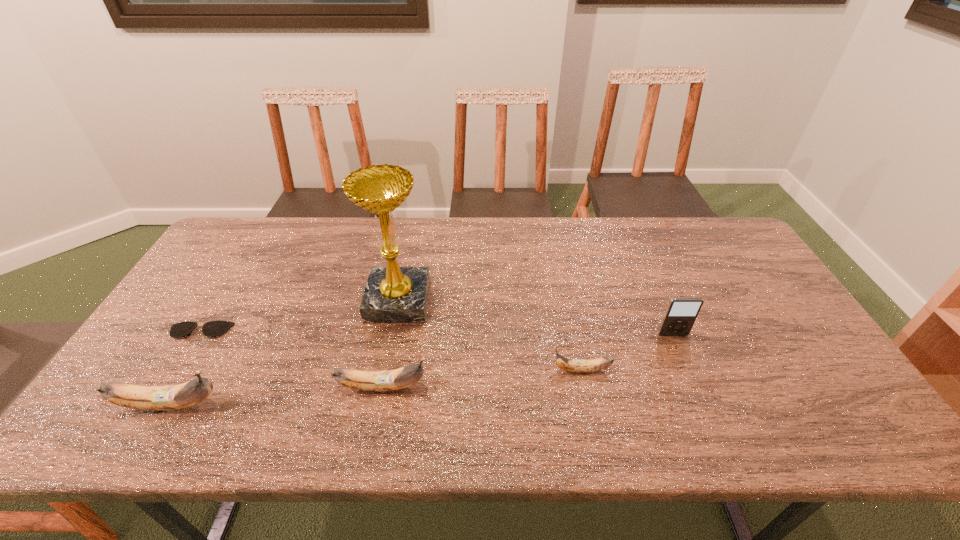
The bananas are evenly distributed in the image. To maintain this, where would you place another banana on the right? Please point to a free space. Please provide its 2D coordinates. Your answer should be formatted as a tuple, i.e. [(x, y)], where the tuple contains the x and y coordinates of a point satisfying the conditions above.

[(767, 355)]